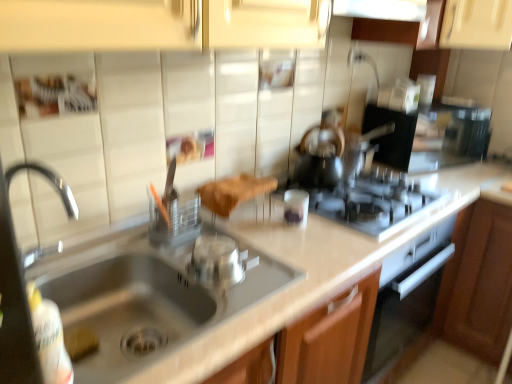
Identify the location of free space on the front side of transparent glass candle at center, which is counted as the 1th appliance, starting from the top. This screenshot has height=384, width=512. (300, 255).